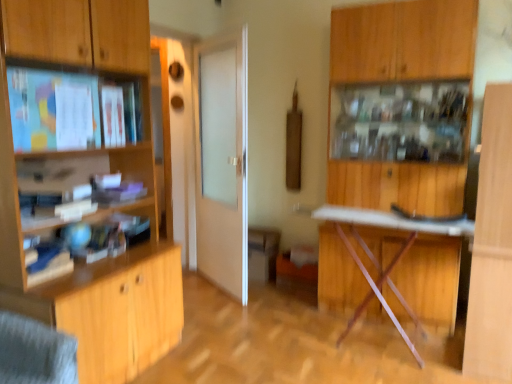
Locate an element on the screen. Image resolution: width=512 pixels, height=384 pixels. free space underneath metallic silver table at center (from a real-world perspective) is located at coordinates (367, 335).